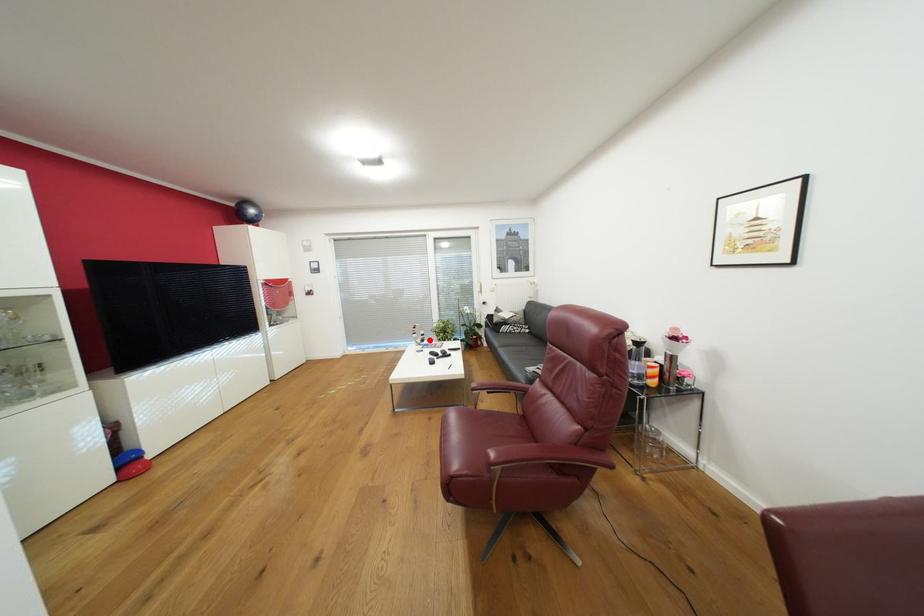
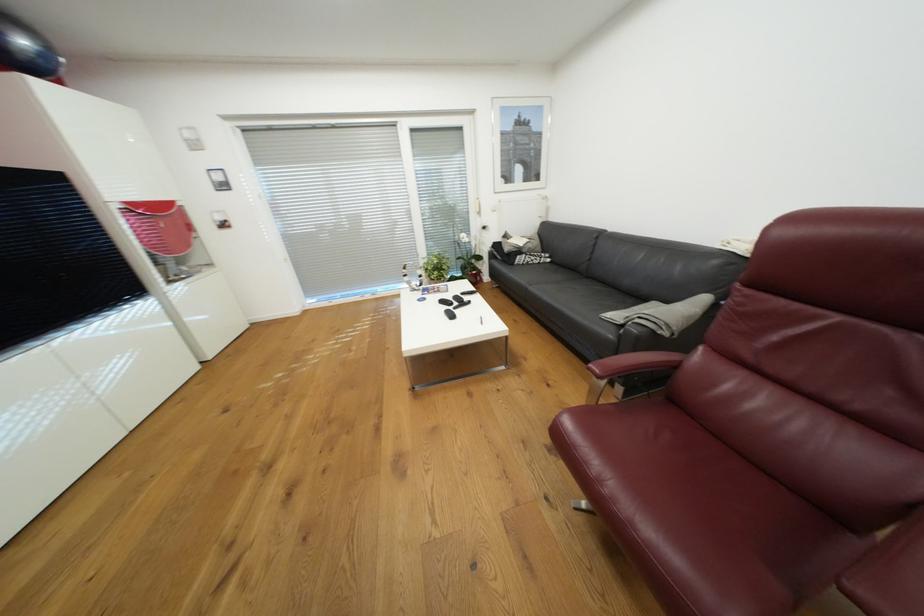
Question: I am providing you with two images of the same scene from different viewpoints. Given a red point in image1, look at the same physical point in image2. Is it:

Choices:
 (A) Closer to the viewpoint
 (B) Farther from the viewpoint

Answer: (A)